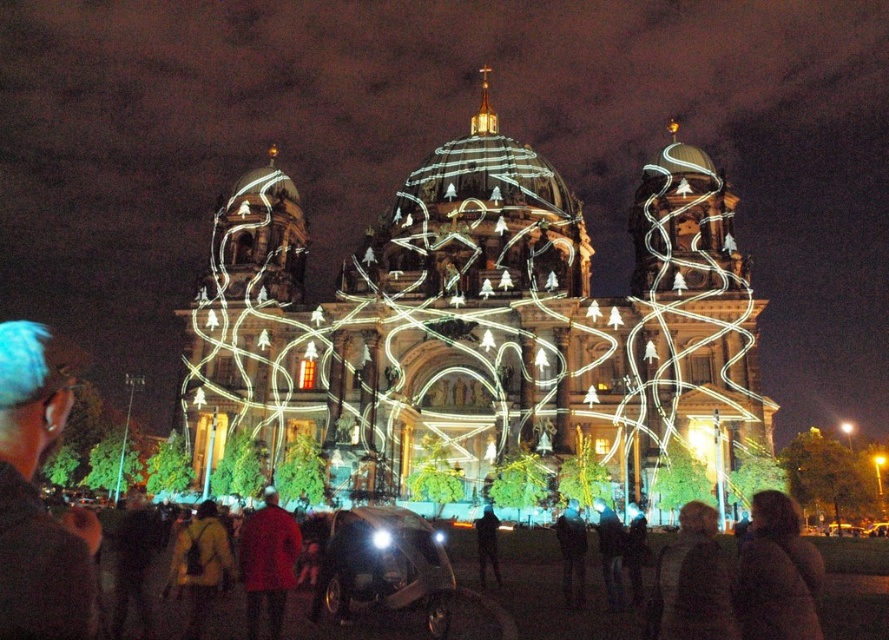
Question: Which point appears closest to the camera in this image?

Choices:
 (A) (479, 536)
 (B) (90, 604)
 (C) (253, 611)

Answer: (B)

Question: Based on their relative distances, which object is farther from the dark blue fabric jacket at center?

Choices:
 (A) red matte coat at center
 (B) dark brown leather jacket at center

Answer: (A)

Question: Does brown fuzzy coat at lower right appear over dark brown leather jacket at center?

Choices:
 (A) yes
 (B) no

Answer: (A)

Question: Which point is closer to the camera?

Choices:
 (A) yellow fabric bag at lower center
 (B) brown fuzzy coat at lower right

Answer: (B)

Question: Observing the image, what is the correct spatial positioning of brown fuzzy coat at lower right in reference to yellow fabric bag at lower center?

Choices:
 (A) below
 (B) above

Answer: (B)

Question: Can you confirm if blue hair at left is bigger than dark brown leather jacket at center?

Choices:
 (A) yes
 (B) no

Answer: (A)